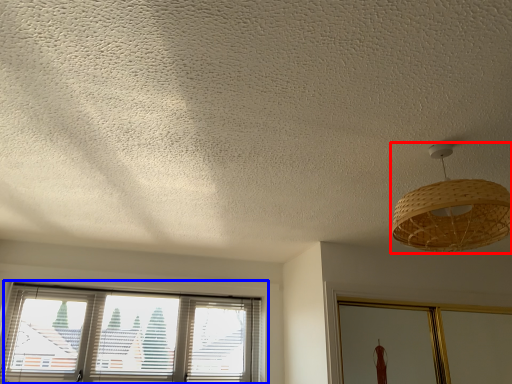
Question: Which object appears closest to the camera in this image, lamp (highlighted by a red box) or window (highlighted by a blue box)?

Choices:
 (A) lamp
 (B) window

Answer: (A)